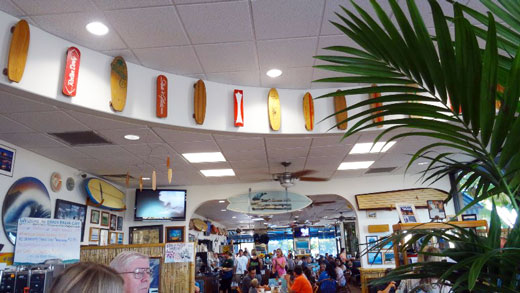
Where is `ceiling`? This screenshot has height=293, width=520. ceiling is located at coordinates (147, 34).